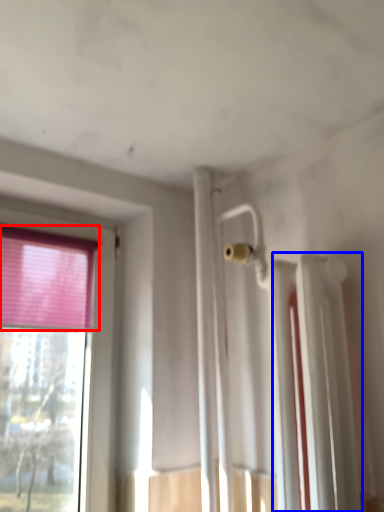
Question: Among these objects, which one is nearest to the camera, curtain (highlighted by a red box) or radiator (highlighted by a blue box)?

Choices:
 (A) curtain
 (B) radiator

Answer: (B)